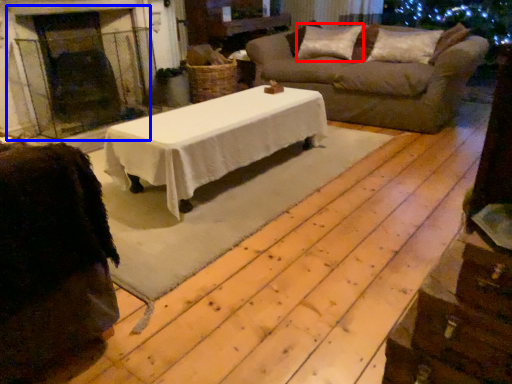
Question: Which of the following is the closest to the observer, pillow (highlighted by a red box) or fireplace (highlighted by a blue box)?

Choices:
 (A) pillow
 (B) fireplace

Answer: (B)